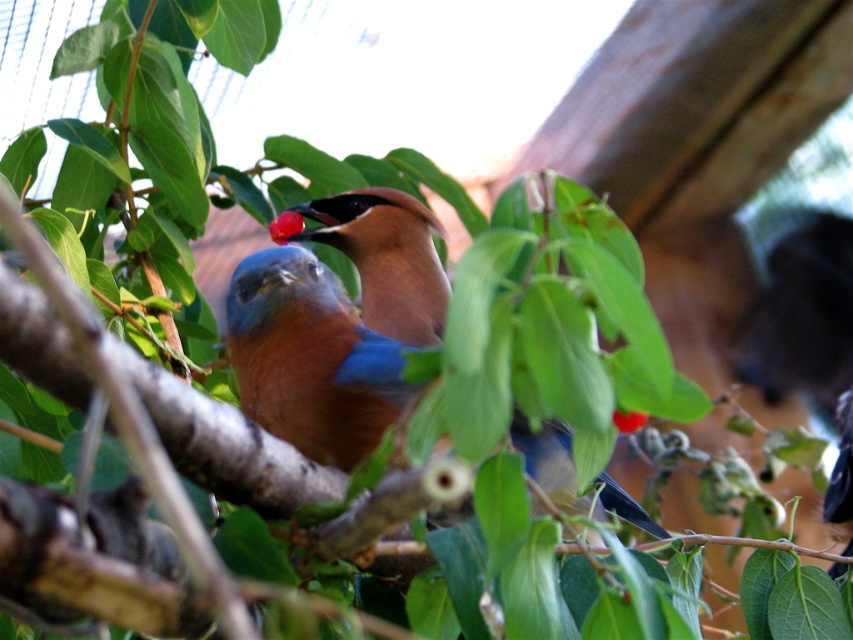
You are a bird perched on a branch and you see both the red matte cherry at center and the glossy red berry at center. Which one is closer to you?

The red matte cherry at center is closer to you because it is in front of the glossy red berry at center.

You are a birdwatcher trying to capture a photo of the blue glossy bird at center and the red matte cherry at center. Which object should you focus on first if you want to ensure both are in focus?

The blue glossy bird at center is taller than the red matte cherry at center. To ensure both are in focus, you should focus on the blue glossy bird at center first since it is larger and requires more precise focus.

You are standing in a natural setting and see the blue glossy bird at center. If you want to take a photo of it without disturbing it, what is the minimum safe distance you should maintain?

The blue glossy bird at center and viewer are 1.57 meters apart, so the minimum safe distance to maintain is 1.57 meters to avoid disturbing it.